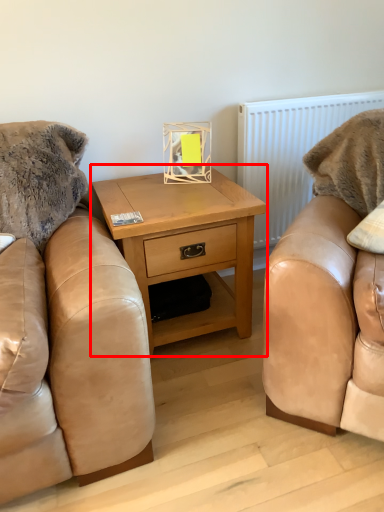
Question: Considering the relative positions of nightstand (annotated by the red box) and radiator in the image provided, where is nightstand (annotated by the red box) located with respect to the staircase?

Choices:
 (A) left
 (B) right

Answer: (A)